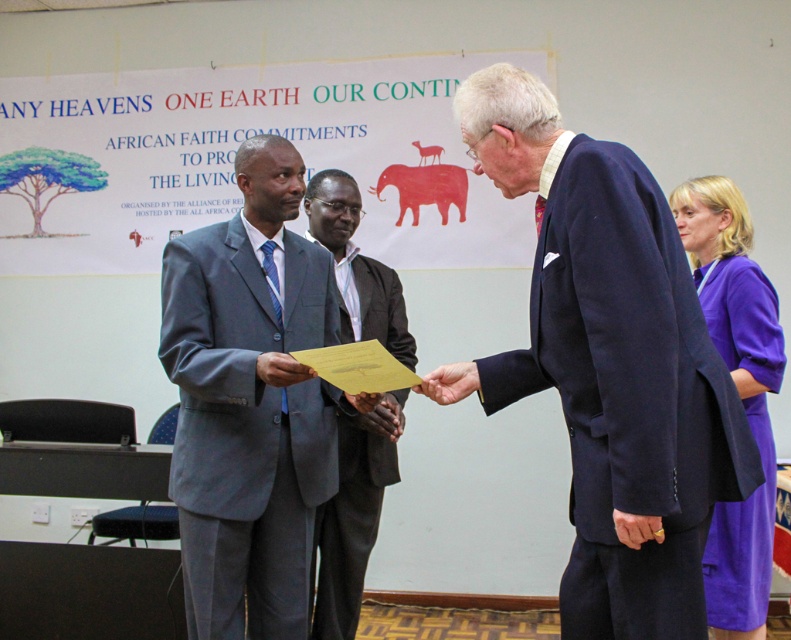
You are an event photographer who needs to capture a clear photo of both the matte gray suit at center and the purple fabric dress at right. Based on their positions, which one is closer to the camera?

The matte gray suit at center is closer to the camera since it is in front of the purple fabric dress at right.

You are standing at the origin point of the coordinate system. You want to move towards the matte gray suit at center. Which direction should you move in the x and y axes?

To reach the matte gray suit at center located at coordinate point (252, 403), you should move in the positive x and positive y directions.

You are an event photographer at the ceremony. You want to capture a photo where both the navy blue suit at center and the matte gray suit at center are clearly visible. Is the current arrangement allowing you to see both suits without one blocking the other?

The navy blue suit at center is in front of the matte gray suit at center, so the navy blue suit at center may block the view of the matte gray suit at center. Adjust the position to ensure both are visible.